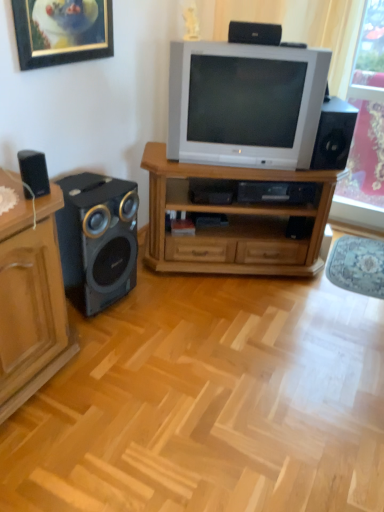
Question: Is black plastic speaker at right, marked as the 3th loudspeaker in a bottom-to-top arrangement, positioned before matte wood cabinet at left?

Choices:
 (A) yes
 (B) no

Answer: (B)

Question: Is black plastic speaker at right, the 2th loudspeaker in the top-to-bottom sequence, shorter than matte wood cabinet at left?

Choices:
 (A) no
 (B) yes

Answer: (B)

Question: Is matte wood cabinet at left surrounded by black plastic speaker at right, marked as the 3th loudspeaker in a bottom-to-top arrangement?

Choices:
 (A) yes
 (B) no

Answer: (B)

Question: Does black plastic speaker at right, acting as the 1th loudspeaker starting from the right, come behind matte wood cabinet at left?

Choices:
 (A) yes
 (B) no

Answer: (A)

Question: Can you confirm if black plastic speaker at right, the fourth loudspeaker positioned from the left, is positioned to the left of matte wood cabinet at left?

Choices:
 (A) no
 (B) yes

Answer: (A)

Question: Choose the correct answer: Is black plastic speaker at right, acting as the 1th loudspeaker starting from the right, inside matte wood cabinet at left or outside it?

Choices:
 (A) outside
 (B) inside

Answer: (A)

Question: Is black plastic speaker at right, acting as the 1th loudspeaker starting from the right, bigger or smaller than matte wood cabinet at left?

Choices:
 (A) small
 (B) big

Answer: (A)

Question: Is black plastic speaker at right, marked as the 3th loudspeaker in a bottom-to-top arrangement, wider or thinner than matte wood cabinet at left?

Choices:
 (A) wide
 (B) thin

Answer: (B)

Question: Would you say black plastic speaker at right, the fourth loudspeaker positioned from the left, is to the left or to the right of matte wood cabinet at left in the picture?

Choices:
 (A) left
 (B) right

Answer: (B)

Question: From the image's perspective, relative to wooden tv stand at center, is black plastic speaker at right, marked as the 3th loudspeaker in a bottom-to-top arrangement, above or below?

Choices:
 (A) below
 (B) above

Answer: (B)

Question: Is black plastic speaker at right, the fourth loudspeaker positioned from the left, wider or thinner than wooden tv stand at center?

Choices:
 (A) thin
 (B) wide

Answer: (A)

Question: Looking at the image, does black plastic speaker at right, the 2th loudspeaker in the top-to-bottom sequence, seem bigger or smaller compared to wooden tv stand at center?

Choices:
 (A) small
 (B) big

Answer: (A)

Question: Relative to wooden tv stand at center, is black plastic speaker at right, the fourth loudspeaker positioned from the left, in front or behind?

Choices:
 (A) behind
 (B) front

Answer: (B)

Question: Is gold-framed picture at upper left in front of or behind pink floral curtain at right in the image?

Choices:
 (A) behind
 (B) front

Answer: (B)

Question: From a real-world perspective, is gold-framed picture at upper left positioned above or below pink floral curtain at right?

Choices:
 (A) above
 (B) below

Answer: (A)